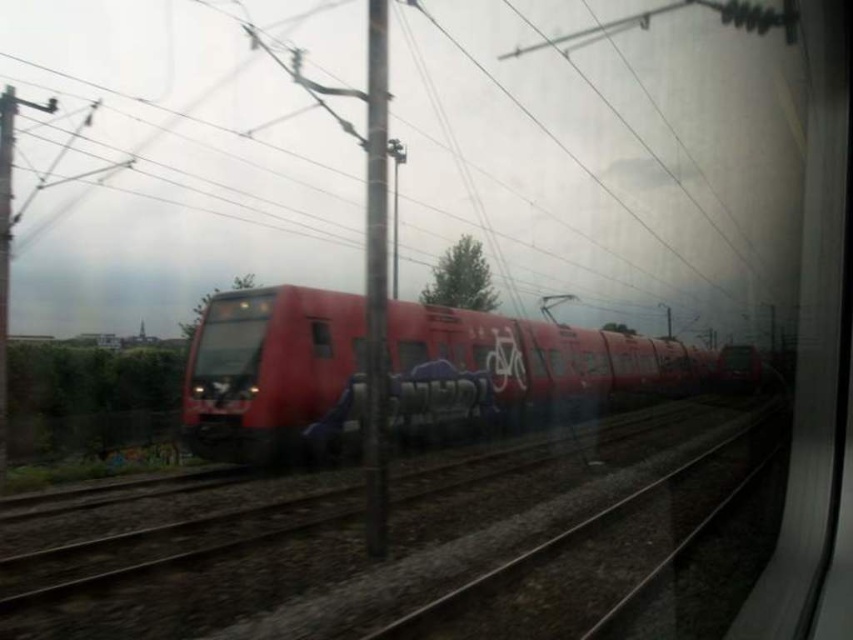
You are standing inside the train and looking out the window. You see a point marked at coordinates (396, 544). What object does this point correspond to?

The point at coordinates (396, 544) corresponds to the metal track at center.

You are a passenger on the transparent glass train at center. You notice the metal track at center below you. Which object is taller from your perspective?

The transparent glass train at center is taller than the metal track at center.